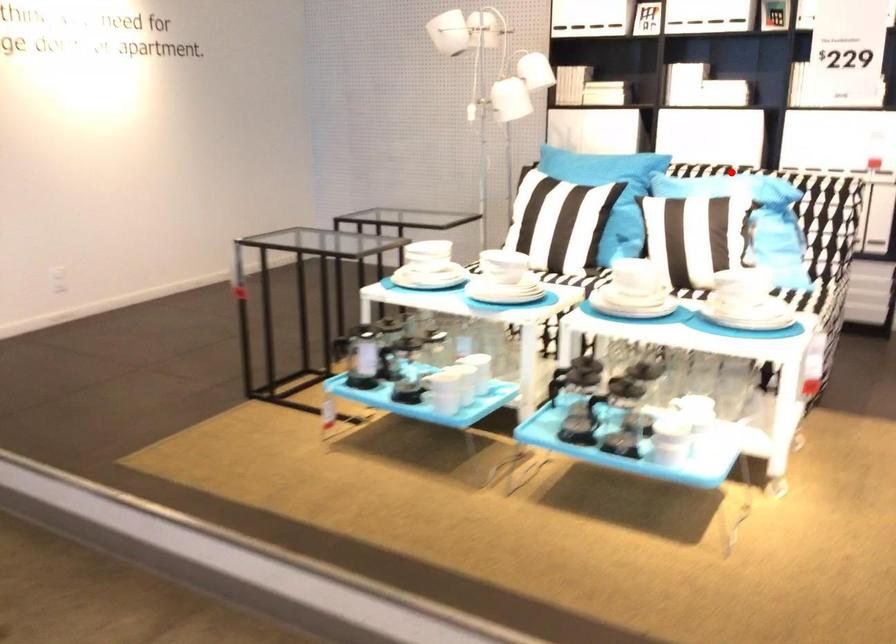
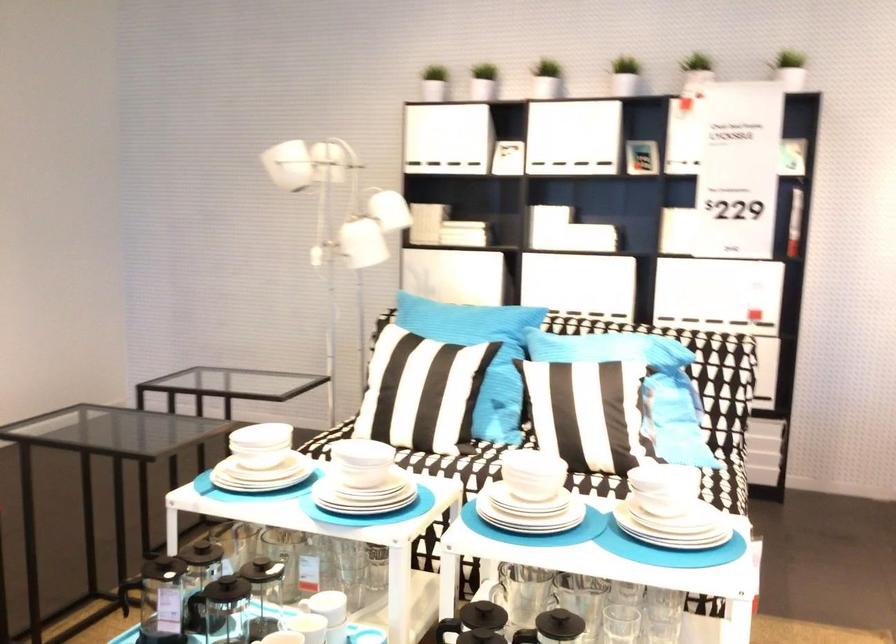
Question: A red point is marked in image1. In image2, is the corresponding 3D point closer to the camera or farther? Reply with the corresponding letter.

Choices:
 (A) The corresponding 3D point is closer.
 (B) The corresponding 3D point is farther.

Answer: (A)